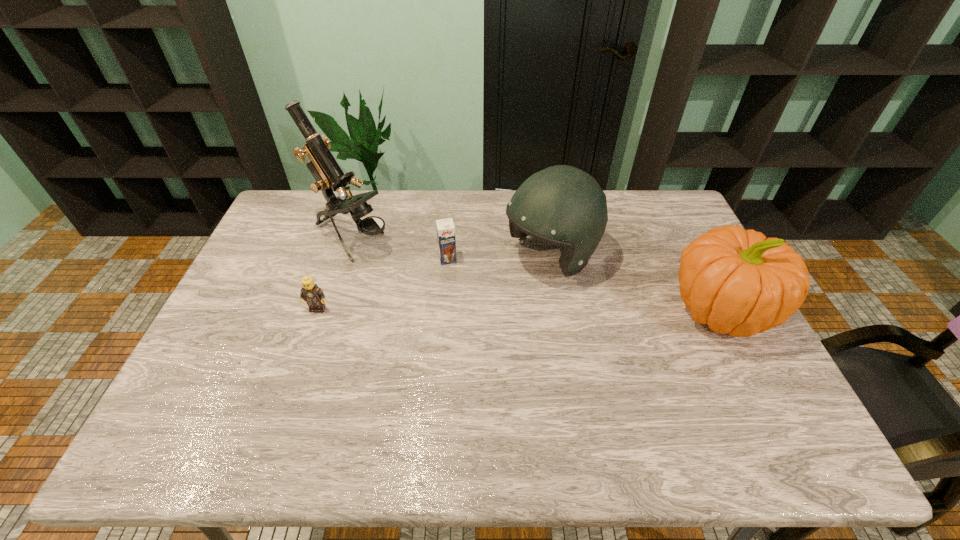
Identify the location of vacant space on the desktop that is between the Lego and the pumpkin and is positioned through the eyepiece of the tallest object. Image resolution: width=960 pixels, height=540 pixels. (473, 309).

The height and width of the screenshot is (540, 960). In order to click on vacant space on the desktop that is between the Lego and the pumpkin and is positioned on the front label of the second shortest object in this screenshot , I will do `click(460, 309)`.

This screenshot has width=960, height=540. Identify the location of vacant spot on the desktop that is between the Lego and the pumpkin and is positioned at the face opening of the fourth object from left to right. (467, 309).